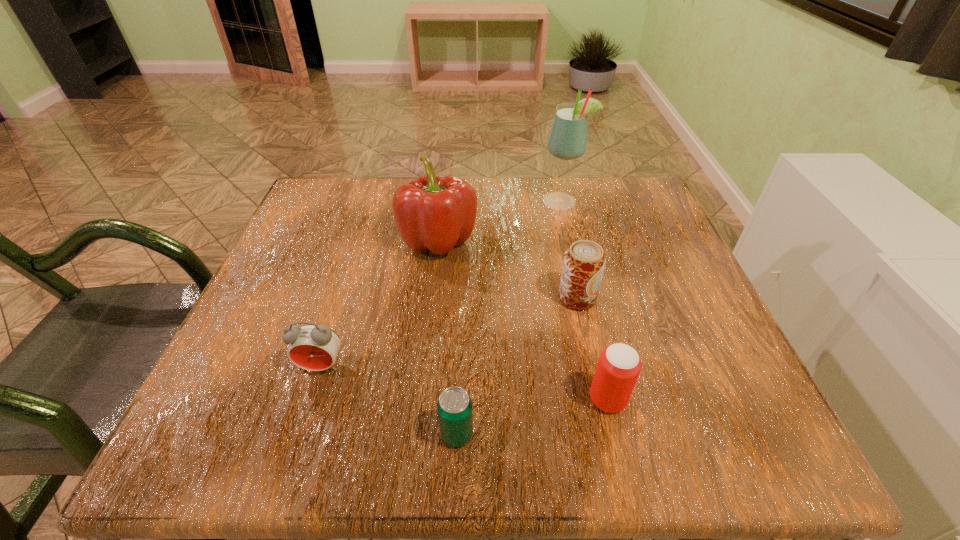
This screenshot has width=960, height=540. What are the coordinates of `free space located 0.260m on the left of the alcohol` in the screenshot? It's located at (432, 202).

You are a GUI agent. You are given a task and a screenshot of the screen. Output one action in this format:
    pyautogui.click(x=<x>, y=<y>)
    Task: Click on the free space located on the front of the pepper
    This screenshot has width=960, height=540.
    Given the screenshot: What is the action you would take?
    pyautogui.click(x=432, y=291)

Image resolution: width=960 pixels, height=540 pixels. I want to click on vacant area located 0.290m on the left of the farthest beer can, so click(402, 298).

At what (x,y) coordinates should I click in order to perform the action: click on free space located 0.110m on the face of the alarm clock. Please return your answer as a coordinate pair (x, y). Looking at the image, I should click on (297, 444).

At what (x,y) coordinates should I click in order to perform the action: click on vacant space located on the back of the second nearest object. Please return your answer as a coordinate pair (x, y). The width and height of the screenshot is (960, 540). Looking at the image, I should click on (586, 308).

Locate an element on the screen. The height and width of the screenshot is (540, 960). free space located 0.180m on the left of the nearest beer can is located at coordinates (314, 434).

Find the location of a particular element. alcohol that is at the far edge is located at coordinates (568, 139).

Identify the location of pepper located at the far edge. (433, 213).

In order to click on object that is at the left edge in this screenshot , I will do `click(313, 347)`.

At what (x,y) coordinates should I click in order to perform the action: click on free space at the far edge of the desktop. Please return your answer as a coordinate pair (x, y). The height and width of the screenshot is (540, 960). Looking at the image, I should click on 568,187.